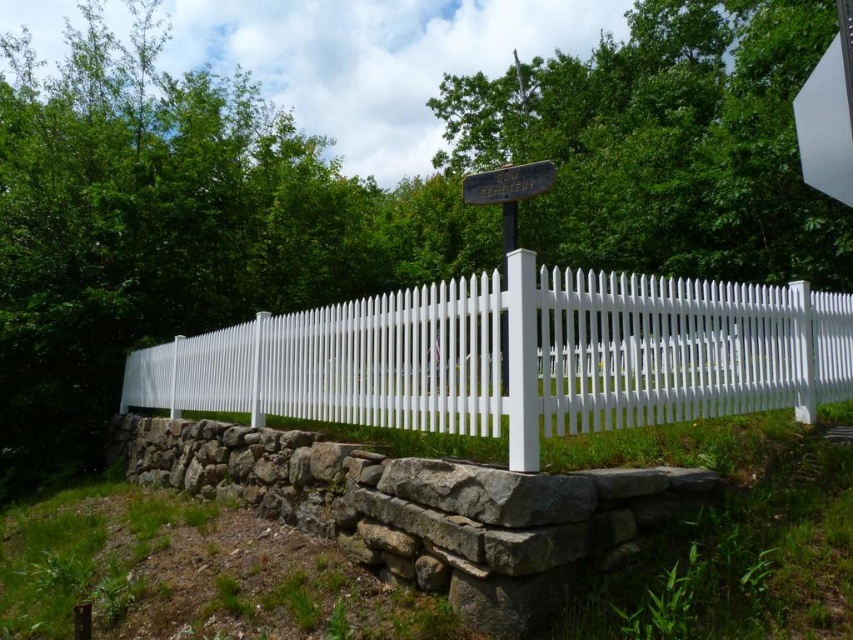
This screenshot has width=853, height=640. Describe the element at coordinates (683, 349) in the screenshot. I see `white painted wood picket fence at center` at that location.

Is white painted wood picket fence at center below wooden signpost at center?

Correct, white painted wood picket fence at center is located below wooden signpost at center.

Locate an element on the screen. This screenshot has height=640, width=853. white painted wood picket fence at center is located at coordinates 683,349.

Can you confirm if white painted wood picket fence at center is positioned above white wooden post at center?

No, white painted wood picket fence at center is not above white wooden post at center.

Find the location of a particular element. white painted wood picket fence at center is located at coordinates (683, 349).

Locate an element on the screen. The width and height of the screenshot is (853, 640). white painted wood picket fence at center is located at coordinates (683, 349).

This screenshot has height=640, width=853. Find the location of `white smooth post at center`. white smooth post at center is located at coordinates (521, 360).

This screenshot has height=640, width=853. Find the location of `white smooth post at center`. white smooth post at center is located at coordinates (521, 360).